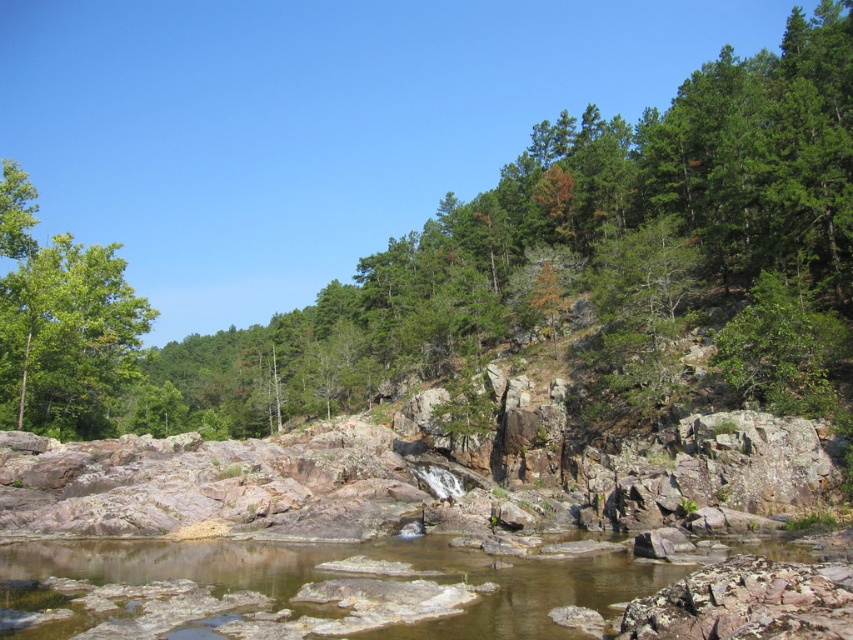
In the scene shown: Which of these two, green leafy tree at upper center or green leafy tree at left, stands shorter?

With less height is green leafy tree at left.

Is green leafy tree at upper center above green leafy tree at left?

Yes.

This screenshot has width=853, height=640. Find the location of `green leafy tree at upper center`. green leafy tree at upper center is located at coordinates [467, 253].